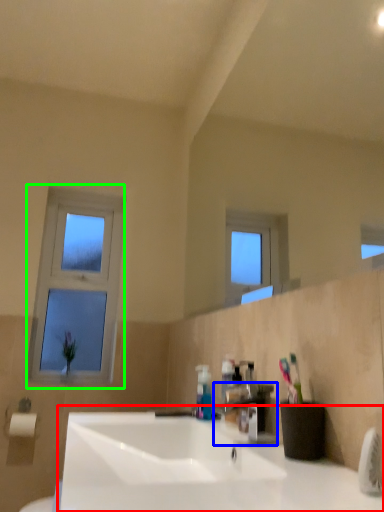
Question: Which object is the closest to the sink (highlighted by a red box)? Choose among these: tap (highlighted by a blue box) or window (highlighted by a green box).

Choices:
 (A) tap
 (B) window

Answer: (A)